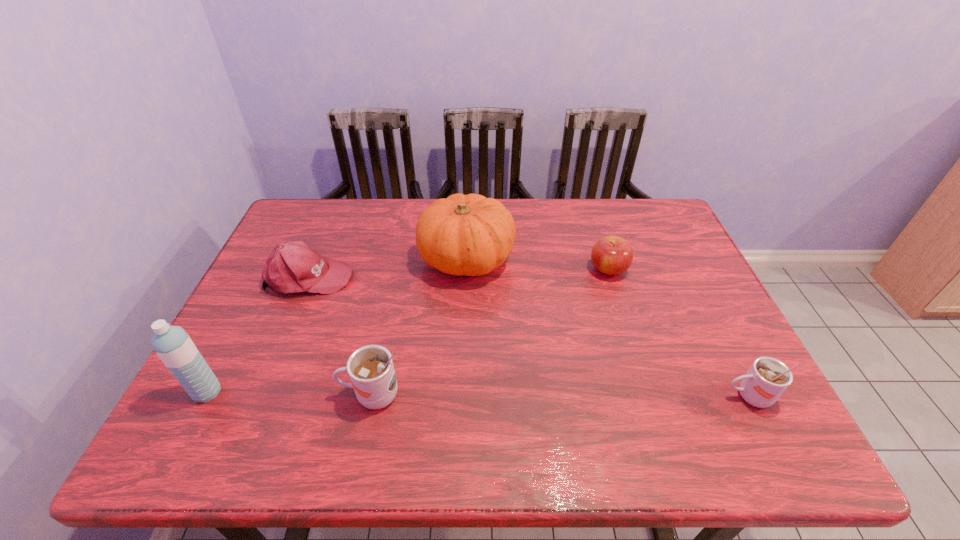
I want to click on free space that satisfies the following two spatial constraints: 1. on the front side of the apple; 2. on the side with the handle of the taller cup, so click(648, 395).